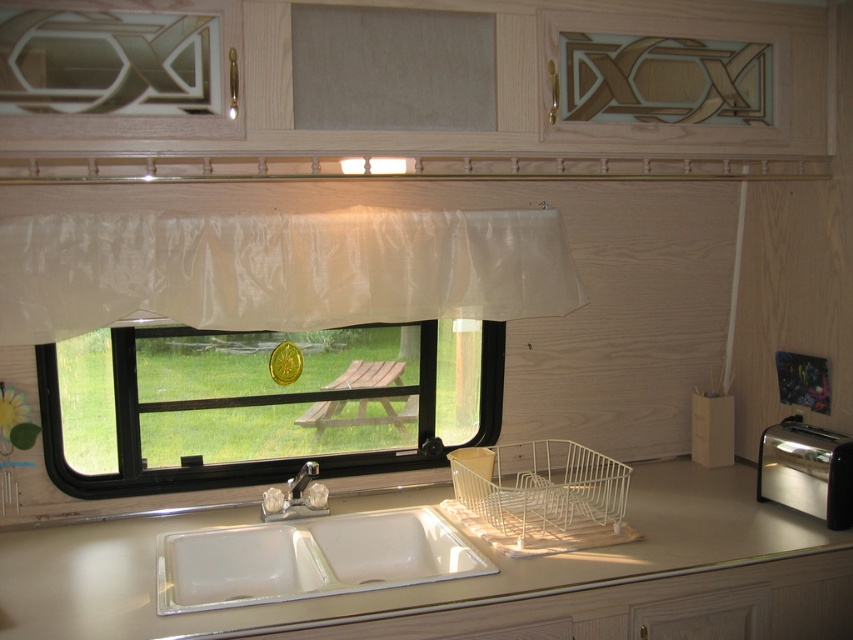
You are a delivery person trying to place a new toaster that is 15 cm tall on the counter. The black plastic window at center and the silver metallic faucet at sink center are already there. Can the new toaster fit vertically between them?

The black plastic window at center is much taller than the silver metallic faucet at sink center. Since the new toaster is only 15 cm tall, it can fit vertically between them as long as there is enough horizontal space available.

You are a delivery person who needs to place a 36 inch long package between the black plastic window at center and the satin silver toaster at right. Can you fit it horizontally between them?

The distance between the black plastic window at center and the satin silver toaster at right is 37.24 inches. Since the package is 36 inches long, it can fit horizontally between them as there is enough space.